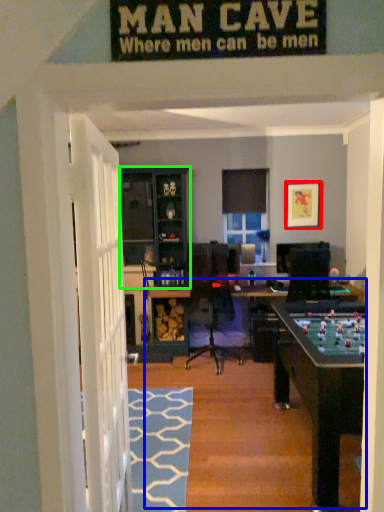
Question: Which object is the closest to the picture frame (highlighted by a red box)? Choose among these: table (highlighted by a blue box) or cabinetry (highlighted by a green box).

Choices:
 (A) table
 (B) cabinetry

Answer: (B)